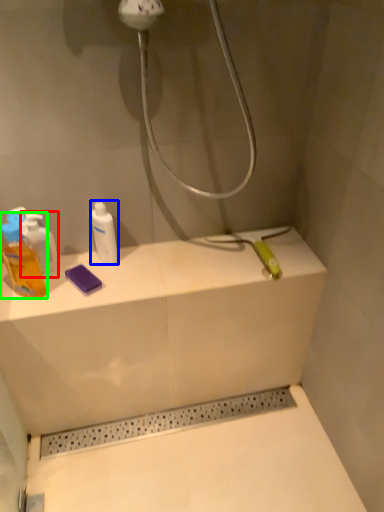
Question: Estimate the real-world distances between objects in this image. Which object is closer to mouthwash (highlighted by a red box), mouthwash (highlighted by a blue box) or mouthwash (highlighted by a green box)?

Choices:
 (A) mouthwash
 (B) mouthwash

Answer: (B)